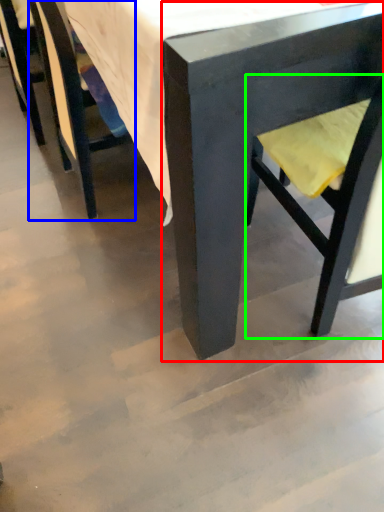
Question: Which object is the closest to the chair (highlighted by a red box)? Choose among these: chair (highlighted by a blue box) or swivel chair (highlighted by a green box).

Choices:
 (A) chair
 (B) swivel chair

Answer: (B)